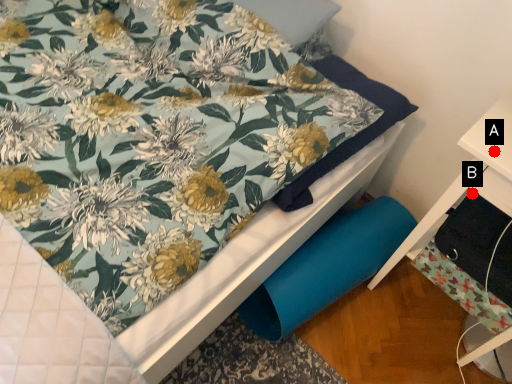
Question: Two points are circled on the image, labeled by A and B beside each circle. Which point is farther from the camera taking this photo?

Choices:
 (A) A is further
 (B) B is further

Answer: (B)